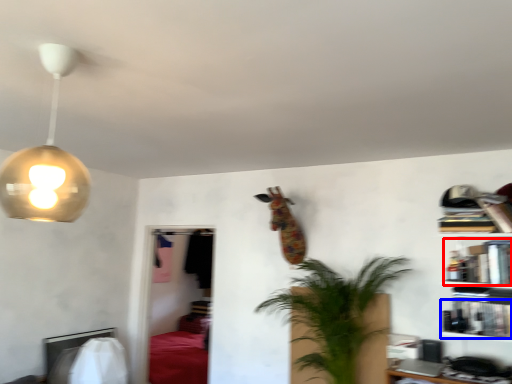
Question: Which point is closer to the camera, book (highlighted by a red box) or book (highlighted by a blue box)?

Choices:
 (A) book
 (B) book

Answer: (B)